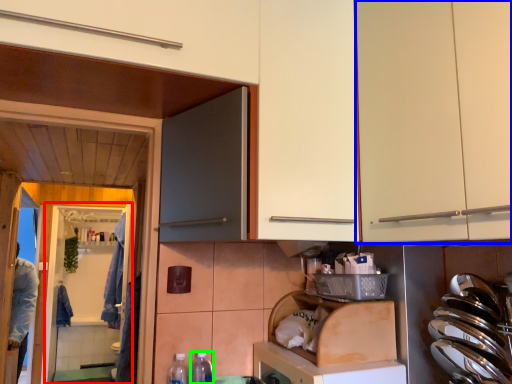
Question: Which object is positioned farthest from screen door (highlighted by a red box)? Select from cabinetry (highlighted by a blue box) and bottle (highlighted by a green box).

Choices:
 (A) cabinetry
 (B) bottle

Answer: (A)